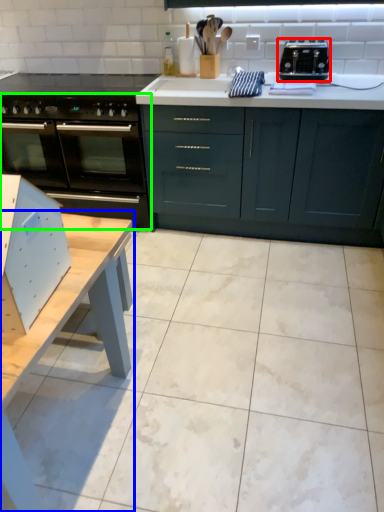
Question: Estimate the real-world distances between objects in this image. Which object is closer to toaster (highlighted by a red box), table (highlighted by a blue box) or oven (highlighted by a green box)?

Choices:
 (A) table
 (B) oven

Answer: (B)